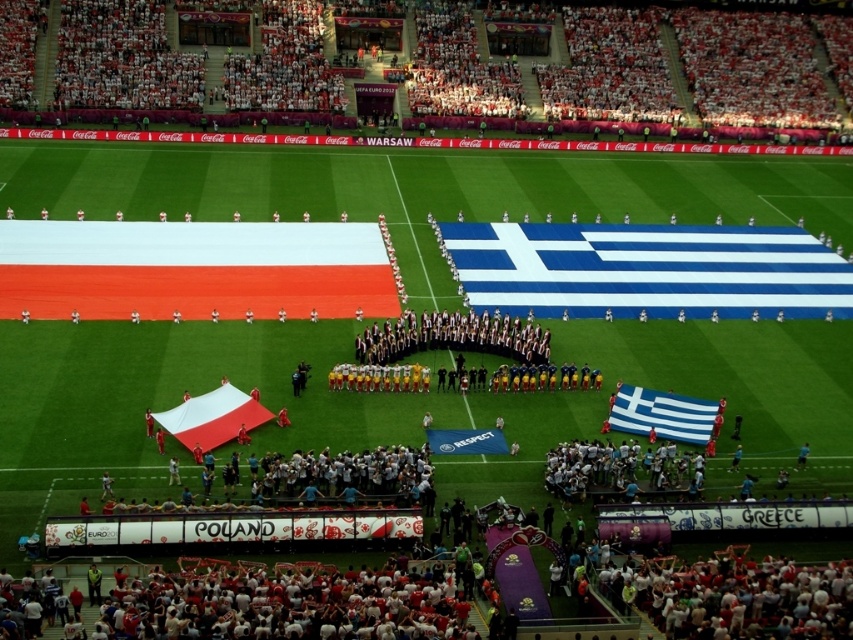
Can you confirm if blue and white fabric flag at lower right is positioned below white matte flag at center?

Yes, blue and white fabric flag at lower right is below white matte flag at center.

In the scene shown: Can you confirm if blue and white fabric flag at lower right is positioned above white matte flag at center?

Incorrect, blue and white fabric flag at lower right is not positioned above white matte flag at center.

What do you see at coordinates (662, 413) in the screenshot? The height and width of the screenshot is (640, 853). I see `blue and white fabric flag at lower right` at bounding box center [662, 413].

Identify the location of blue and white fabric flag at lower right. (662, 413).